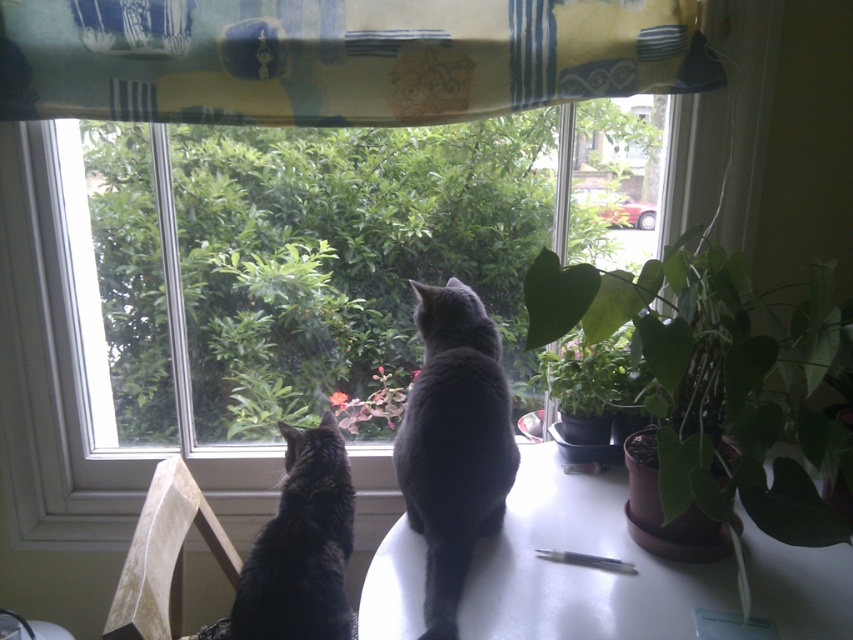
Question: Is white glossy table at center wider than black fur cat at center?

Choices:
 (A) no
 (B) yes

Answer: (B)

Question: From the image, what is the correct spatial relationship of matte gray cat at center in relation to black fur cat at center?

Choices:
 (A) above
 (B) below

Answer: (A)

Question: Is yellow fabric at upper center to the left of black fur cat at center from the viewer's perspective?

Choices:
 (A) yes
 (B) no

Answer: (B)

Question: Based on their relative distances, which object is farther from the green leafy plant at center?

Choices:
 (A) yellow fabric at upper center
 (B) green matte plant at right
 (C) white glossy table at center

Answer: (B)

Question: Which of the following is the closest to the observer?

Choices:
 (A) (331, 577)
 (B) (457, 476)

Answer: (B)

Question: Which object is the closest to the green leafy plant at center?

Choices:
 (A) green matte plant at right
 (B) white glossy table at center
 (C) matte gray cat at center
 (D) yellow fabric at upper center

Answer: (D)